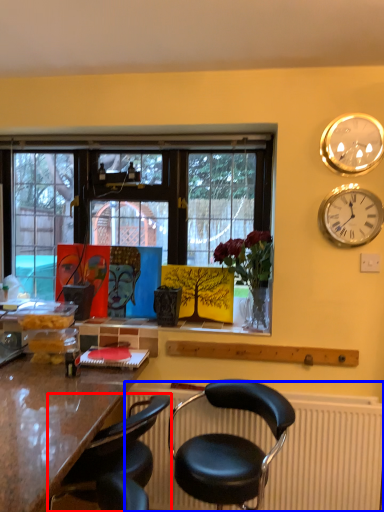
Question: Which object appears closest to the camera in this image, chair (highlighted by a red box) or radiator (highlighted by a blue box)?

Choices:
 (A) chair
 (B) radiator

Answer: (A)